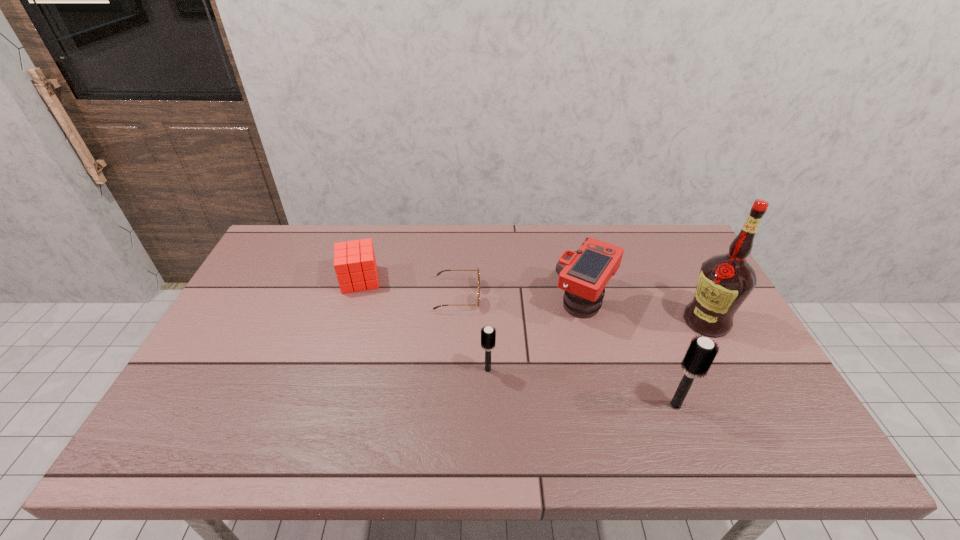
The image size is (960, 540). Identify the location of object at the right edge. (725, 281).

In the image, there is a desktop. Where is `vacant space at the far edge`? vacant space at the far edge is located at coordinates (353, 233).

Image resolution: width=960 pixels, height=540 pixels. Identify the location of free space at the near edge of the desktop. (580, 392).

This screenshot has width=960, height=540. What are the coordinates of `free spot at the left edge of the desktop` in the screenshot? It's located at (235, 338).

In the image, there is a desktop. At what (x,y) coordinates should I click in order to perform the action: click on vacant space at the right edge. Please return your answer as a coordinate pair (x, y). The height and width of the screenshot is (540, 960). Looking at the image, I should click on (691, 272).

What are the coordinates of `unoccupied position between the rightmost object and the farther hairbrush` in the screenshot? It's located at (597, 345).

Locate an element on the screen. vacant area that lies between the second shortest object and the tallest object is located at coordinates (533, 300).

Where is `free space between the alcohol and the camera`? The width and height of the screenshot is (960, 540). free space between the alcohol and the camera is located at coordinates (645, 311).

Where is `vacant point located between the left hairbrush and the third object from right to left`? This screenshot has height=540, width=960. vacant point located between the left hairbrush and the third object from right to left is located at coordinates tap(536, 335).

Find the location of a particular element. The width and height of the screenshot is (960, 540). vacant region between the left hairbrush and the rightmost object is located at coordinates (597, 345).